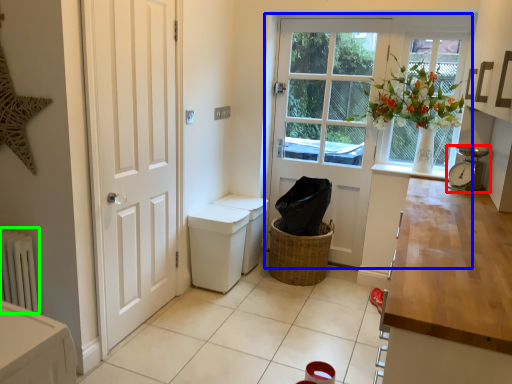
Question: Estimate the real-world distances between objects in this image. Which object is farther from alarm clock (highlighted by a red box), door (highlighted by a blue box) or radiator (highlighted by a green box)?

Choices:
 (A) door
 (B) radiator

Answer: (B)